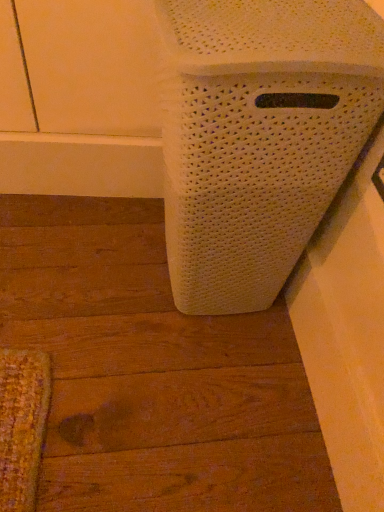
Question: Should I look upward or downward to see white woven basket at center?

Choices:
 (A) up
 (B) down

Answer: (A)